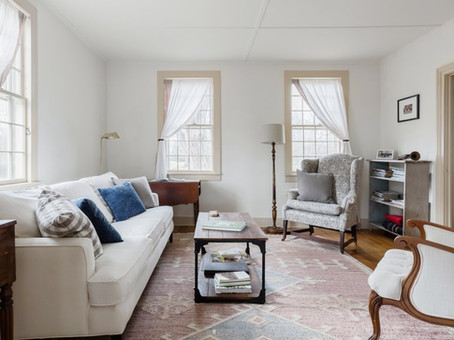
I want to click on throw pillows, so click(x=69, y=215), click(x=95, y=213), click(x=129, y=197), click(x=138, y=190), click(x=316, y=186).